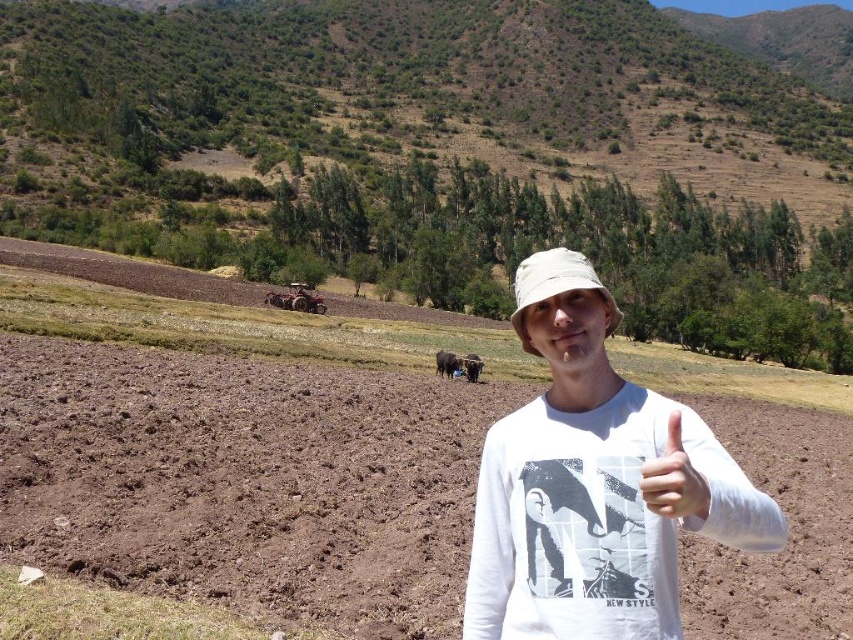
Is point (28, 352) closer to camera compared to point (437, 362)?

Yes, point (28, 352) is in front of point (437, 362).

Does brown soil at center have a lesser height compared to brown fuzzy cow at center?

No, brown soil at center is not shorter than brown fuzzy cow at center.

You are a GUI agent. You are given a task and a screenshot of the screen. Output one action in this format:
    pyautogui.click(x=<x>, y=<y>)
    Task: Click on the brown soil at center
    The width and height of the screenshot is (853, 640).
    Given the screenshot: What is the action you would take?
    pyautogui.click(x=241, y=445)

Can you confirm if brown fuzzy cow at center is positioned below black fur at center?

Incorrect, brown fuzzy cow at center is not positioned below black fur at center.

Who is shorter, brown fuzzy cow at center or black fur at center?

Standing shorter between the two is brown fuzzy cow at center.

From the picture: Who is more distant from viewer, (442, 368) or (465, 376)?

Point (465, 376)

Locate an element on the screen. brown fuzzy cow at center is located at coordinates (445, 362).

Is white fabric hat at center to the right of black fur at center from the viewer's perspective?

Correct, you'll find white fabric hat at center to the right of black fur at center.

Between white fabric hat at center and black fur at center, which one has more height?

With more height is white fabric hat at center.

Is point (607, 330) positioned in front of point (468, 364)?

Yes, it is.

Locate an element on the screen. This screenshot has height=640, width=853. white fabric hat at center is located at coordinates (555, 285).